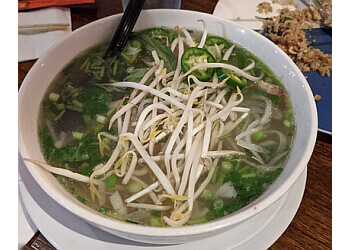
The height and width of the screenshot is (250, 350). Find the location of `napkin`. napkin is located at coordinates (32, 45).